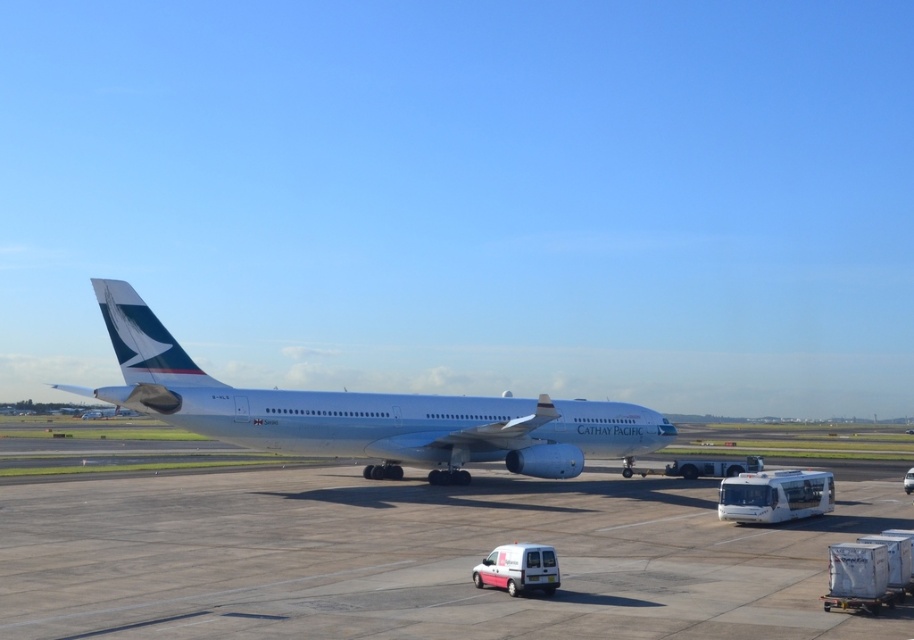
Question: Among these points, which one is nearest to the camera?

Choices:
 (A) (389, 413)
 (B) (709, 604)

Answer: (B)

Question: Considering the relative positions of smooth concrete tarmac at center and silver metallic airplane at center in the image provided, where is smooth concrete tarmac at center located with respect to silver metallic airplane at center?

Choices:
 (A) left
 (B) right

Answer: (B)

Question: Is smooth concrete tarmac at center wider than silver metallic airplane at center?

Choices:
 (A) yes
 (B) no

Answer: (B)

Question: Is smooth concrete tarmac at center to the left of silver metallic airplane at center from the viewer's perspective?

Choices:
 (A) yes
 (B) no

Answer: (B)